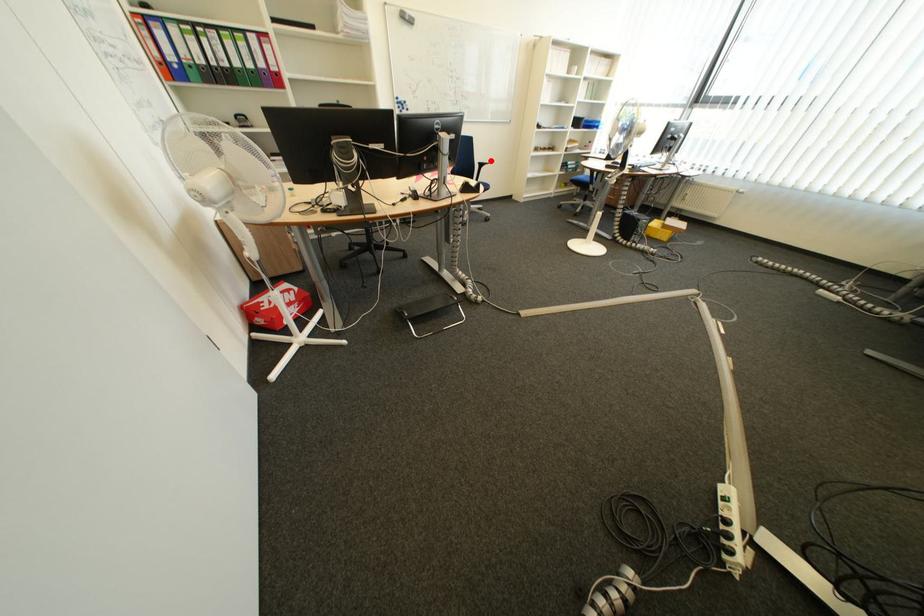
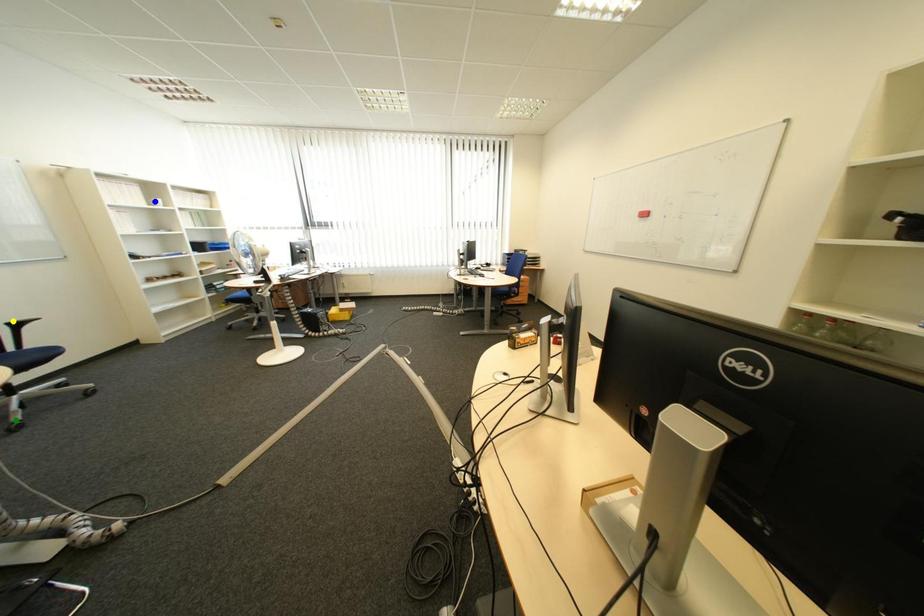
Question: I am providing you with two images of the same scene from different viewpoints. A red point is marked on the first image. You are given multiple points on the second image. Which point in image 2 is actually the same real-world point as the red point in image 1?

Choices:
 (A) yellow point
 (B) green point
 (C) blue point

Answer: (A)